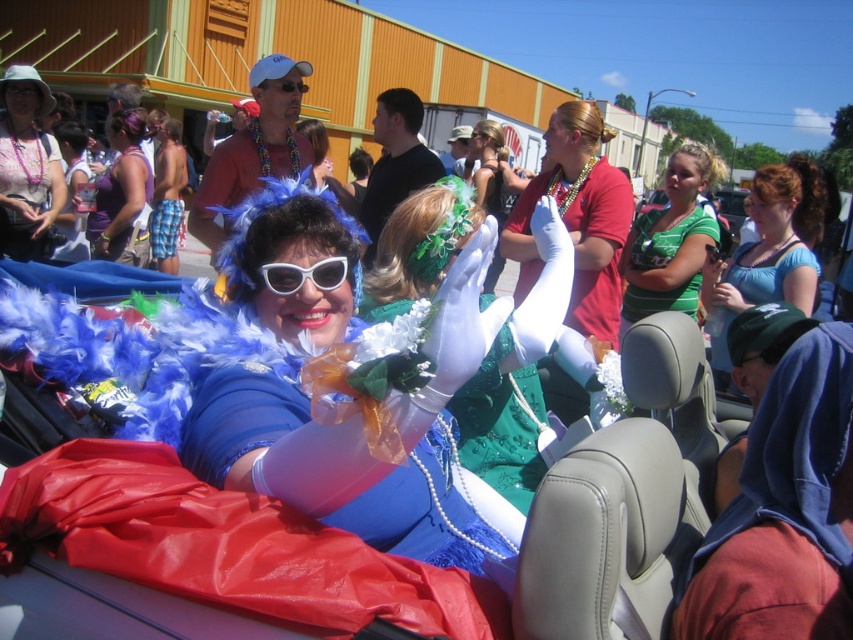
Is matte green dress at center below blue feather boa at upper center?

Yes.

Who is more distant from viewer, (531,280) or (773,244)?

Positioned behind is point (531,280).

Identify the location of matte green dress at center. The image size is (853, 640). (577, 220).

Is blue feather boa at upper center further to camera compared to purple fabric dress at center?

That is False.

Is blue feather boa at upper center closer to the viewer compared to purple fabric dress at center?

Yes.

Is point (722, 358) positioned in front of point (113, 205)?

Yes.

The width and height of the screenshot is (853, 640). What are the coordinates of `blue feather boa at upper center` in the screenshot? It's located at (769, 252).

Does green jersey at center have a lesser height compared to purple fabric dress at center?

Yes, green jersey at center is shorter than purple fabric dress at center.

Which of these two, green jersey at center or purple fabric dress at center, stands shorter?

green jersey at center

Is point (697, 298) closer to camera compared to point (113, 237)?

That is True.

At what (x,y) coordinates should I click in order to perform the action: click on green jersey at center. Please return your answer as a coordinate pair (x, y). The width and height of the screenshot is (853, 640). Looking at the image, I should click on (671, 240).